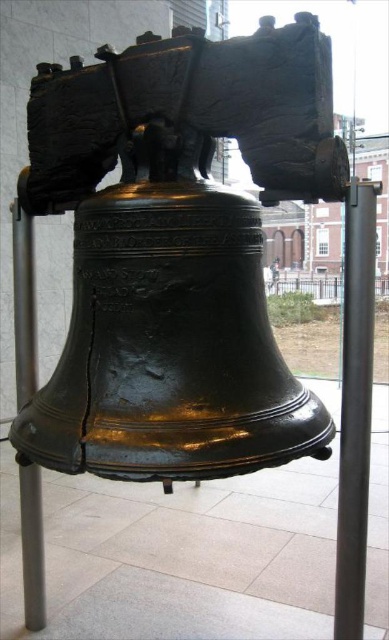
Who is lower down, black metal pole at right or black metal pole at lower left?

→ black metal pole at right

Which is behind, point (364, 428) or point (24, 368)?

The point (24, 368) is more distant.

Locate an element on the screen. black metal pole at right is located at coordinates (355, 406).